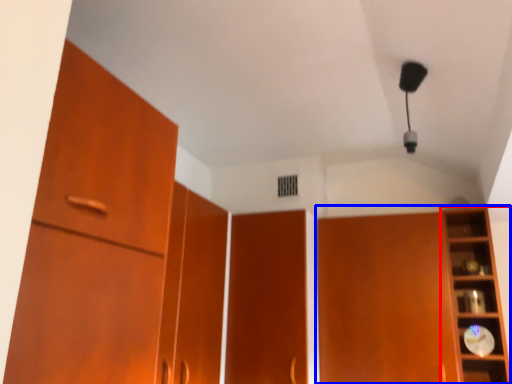
Question: Which object is closer to the camera taking this photo, shelf (highlighted by a red box) or cupboard (highlighted by a blue box)?

Choices:
 (A) shelf
 (B) cupboard

Answer: (A)